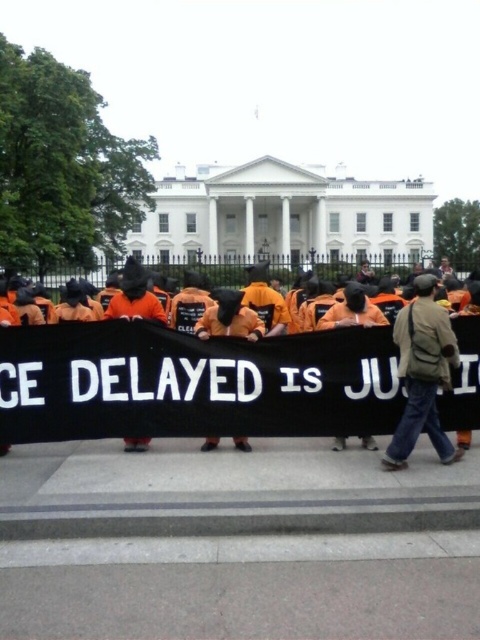
Does orange fabric at center appear on the right side of brown fabric jacket at center?

No, orange fabric at center is not to the right of brown fabric jacket at center.

Between orange fabric at center and brown fabric jacket at center, which one has more height?

With more height is brown fabric jacket at center.

Is point (269, 397) positioned in front of point (431, 397)?

No.

Image resolution: width=480 pixels, height=640 pixels. Find the location of `orange fabric at center`. orange fabric at center is located at coordinates (222, 385).